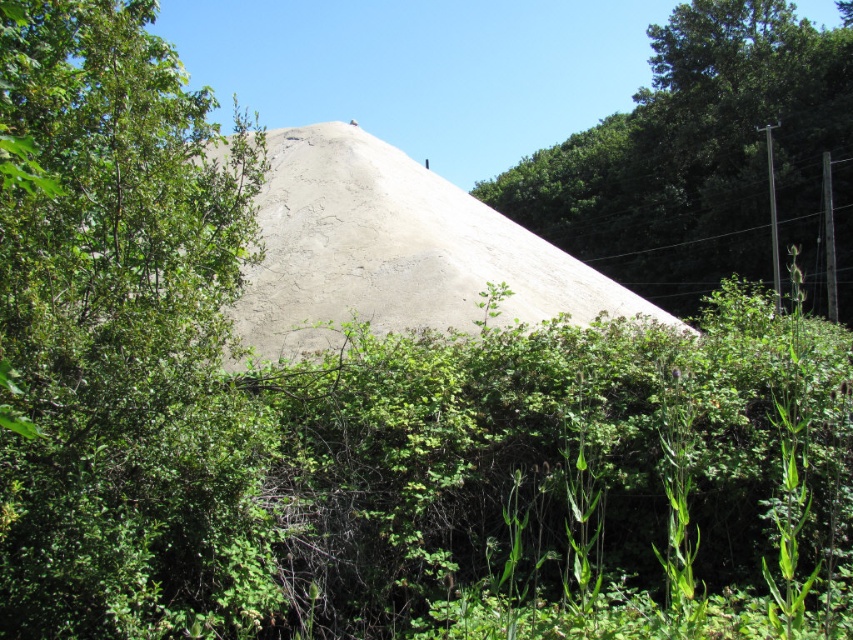
How much distance is there between green leafy tree at upper left and smooth concrete hillside at center?

green leafy tree at upper left and smooth concrete hillside at center are 7.26 feet apart from each other.

Which is more to the left, green leafy tree at upper left or smooth concrete hillside at center?

From the viewer's perspective, green leafy tree at upper left appears more on the left side.

The image size is (853, 640). Describe the element at coordinates (122, 339) in the screenshot. I see `green leafy tree at upper left` at that location.

What are the coordinates of `green leafy tree at upper left` in the screenshot? It's located at (122, 339).

Does green leafy tree at upper right have a lesser width compared to smooth concrete hillside at center?

Incorrect, green leafy tree at upper right's width is not less than smooth concrete hillside at center's.

Which is below, green leafy tree at upper right or smooth concrete hillside at center?

smooth concrete hillside at center is below.

Who is more distant from viewer, (786, 163) or (477, 262)?

Point (786, 163)

This screenshot has height=640, width=853. What are the coordinates of `green leafy tree at upper right` in the screenshot? It's located at (698, 156).

Can you confirm if green leafy tree at upper left is shorter than green leafy tree at upper right?

Correct, green leafy tree at upper left is not as tall as green leafy tree at upper right.

Between green leafy tree at upper left and green leafy tree at upper right, which one is positioned lower?

green leafy tree at upper left is below.

Find the location of a particular element. The image size is (853, 640). green leafy tree at upper left is located at coordinates (122, 339).

The width and height of the screenshot is (853, 640). What are the coordinates of `green leafy tree at upper left` in the screenshot? It's located at (122, 339).